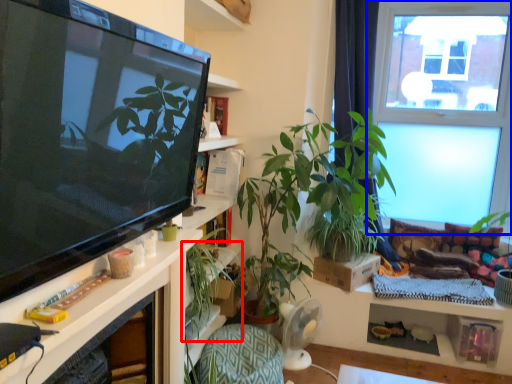
Question: Which object appears closest to the camera in this image, houseplant (highlighted by a red box) or window (highlighted by a blue box)?

Choices:
 (A) houseplant
 (B) window

Answer: (A)